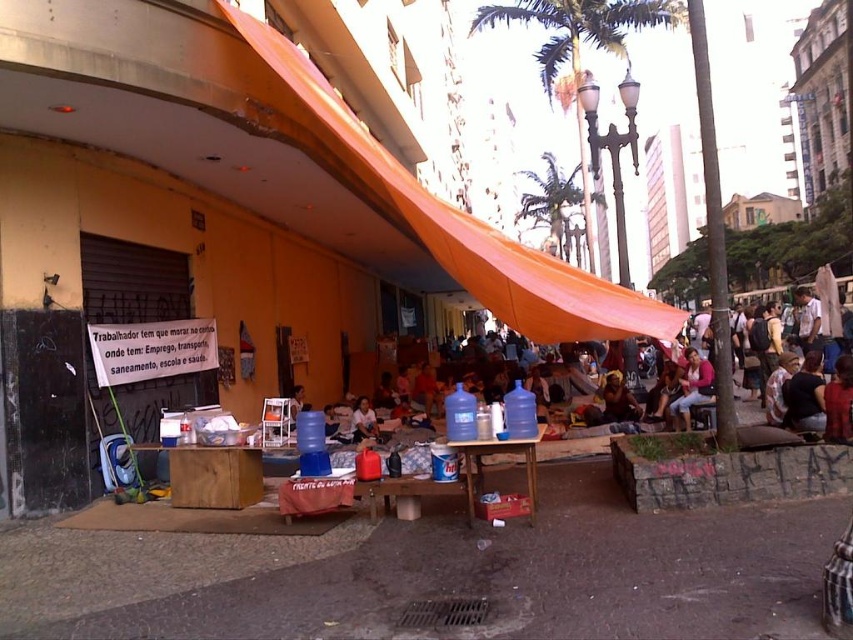
Question: Is the position of wooden table at center more distant than that of smooth plastic bottle at center?

Choices:
 (A) yes
 (B) no

Answer: (B)

Question: Among these objects, which one is nearest to the camera?

Choices:
 (A) wooden table at center
 (B) smooth plastic bottle at center
 (C) brown leather jacket at center
 (D) dark blue shirt at center

Answer: (A)

Question: Can you confirm if wooden table at center is smaller than pink fabric shirt at center?

Choices:
 (A) yes
 (B) no

Answer: (A)

Question: Which point is closer to the camera?

Choices:
 (A) (808, 404)
 (B) (471, 442)
 (C) (669, 403)
 (D) (614, 419)

Answer: (B)

Question: Does pink fabric shirt at center have a lesser width compared to brown leather jacket at center?

Choices:
 (A) no
 (B) yes

Answer: (A)

Question: Which of the following is the farthest from the observer?

Choices:
 (A) (468, 509)
 (B) (799, 417)

Answer: (B)